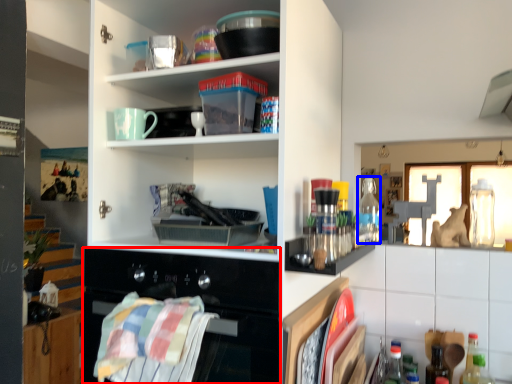
Question: Which point is further to the camera, oven (highlighted by a red box) or bottle (highlighted by a blue box)?

Choices:
 (A) oven
 (B) bottle

Answer: (B)